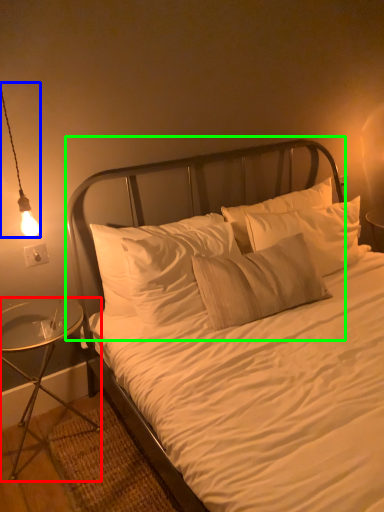
Question: Considering the real-world distances, which object is farthest from nightstand (highlighted by a red box)? lamp (highlighted by a blue box) or headboard (highlighted by a green box)?

Choices:
 (A) lamp
 (B) headboard

Answer: (A)